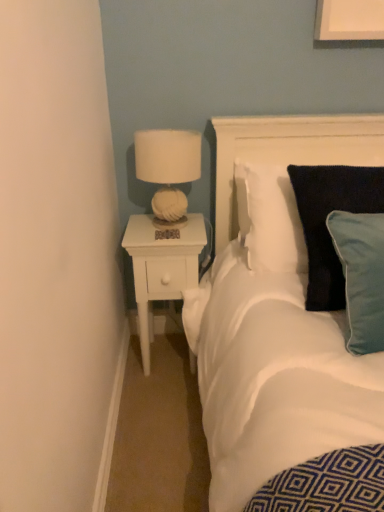
This screenshot has height=512, width=384. In order to click on free point below white fabric lampshade at upper right (from a real-world perspective) in this screenshot , I will do `click(172, 224)`.